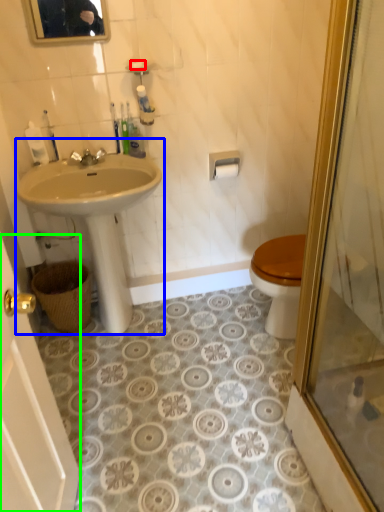
Question: Based on their relative distances, which object is farther from soap (highlighted by a red box)? Choose from sink (highlighted by a blue box) and screen door (highlighted by a green box).

Choices:
 (A) sink
 (B) screen door

Answer: (B)